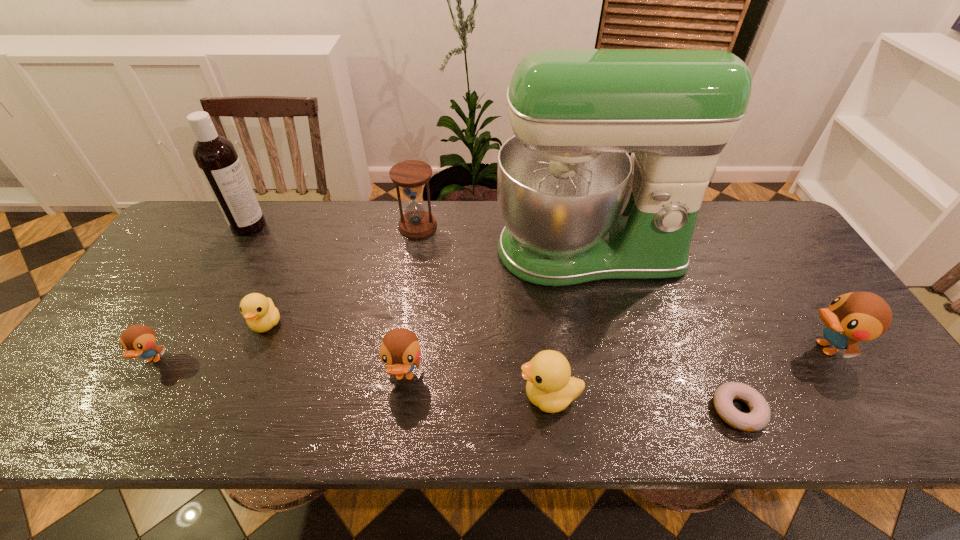
You are a GUI agent. You are given a task and a screenshot of the screen. Output one action in this format:
    pyautogui.click(x=<x>, y=<y>)
    Task: Click on the leftmost duck
    This screenshot has height=540, width=960.
    Given the screenshot: What is the action you would take?
    pyautogui.click(x=137, y=340)

The width and height of the screenshot is (960, 540). I want to click on the leftmost blue duck, so click(x=137, y=340).

Locate an element on the screen. Image resolution: width=960 pixels, height=540 pixels. the left yellow duck is located at coordinates (261, 315).

Locate an element on the screen. the farther yellow duck is located at coordinates (261, 315).

Where is `doughnut`? This screenshot has width=960, height=540. doughnut is located at coordinates (759, 416).

The width and height of the screenshot is (960, 540). What are the coordinates of `the shortest object` in the screenshot? It's located at (759, 416).

Image resolution: width=960 pixels, height=540 pixels. In order to click on vacant space situated 0.180m on the controls of the mixer in this screenshot , I will do point(612,347).

Locate an element on the screen. Image resolution: width=960 pixels, height=540 pixels. vacant space located 0.210m on the label side of the dishwasher detergent is located at coordinates (331, 225).

Identify the location of vacant space located on the left of the hourglass. (282, 226).

At what (x,y) coordinates should I click in order to perform the action: click on free region located on the front-facing side of the biggest blue duck. Please return your answer as a coordinate pair (x, y). Looking at the image, I should click on (714, 347).